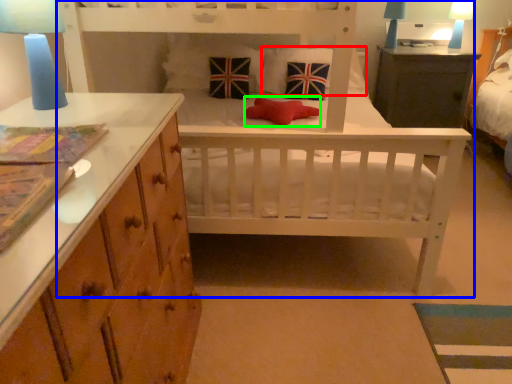
Question: Which object is the farthest from pillow (highlighted by a red box)? Choose among these: infant bed (highlighted by a blue box) or pillow (highlighted by a green box).

Choices:
 (A) infant bed
 (B) pillow

Answer: (A)